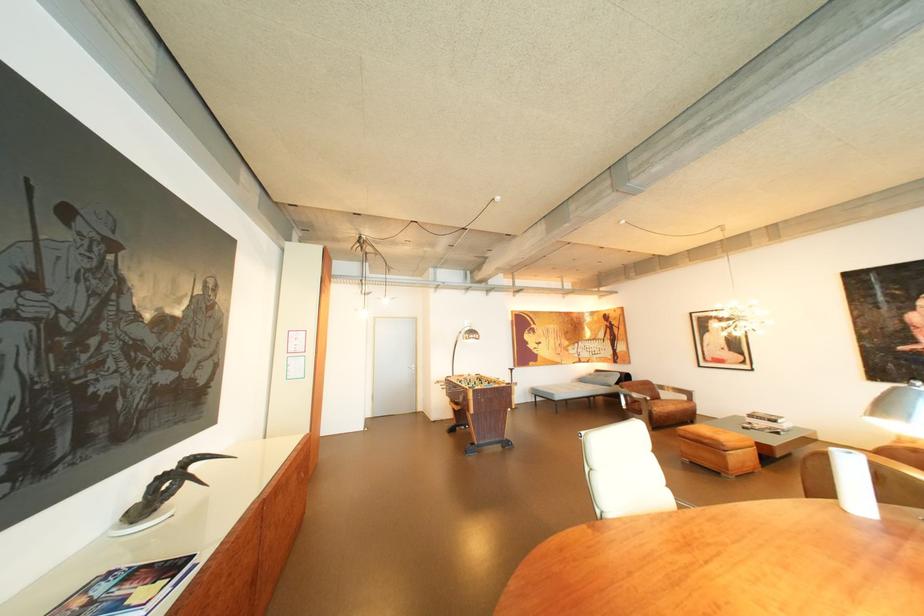
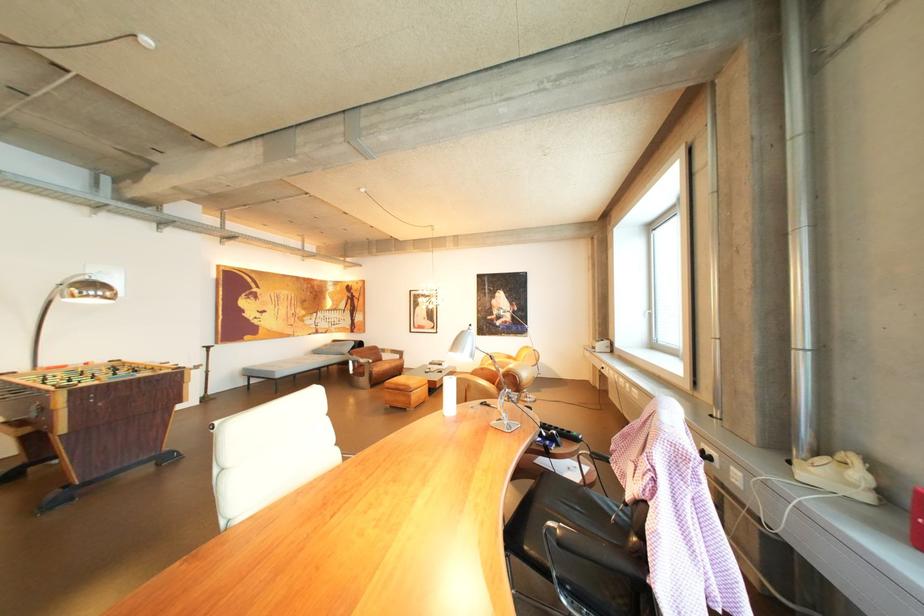
The point at (649, 402) is marked in the first image. Where is the corresponding point in the second image?

(374, 366)